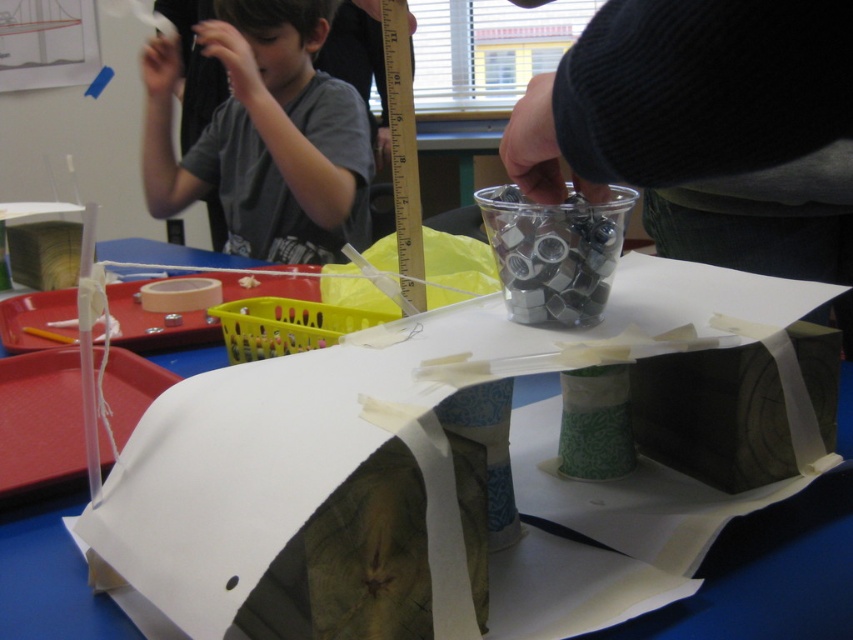
Is point (218, 112) more distant than point (529, 385)?

Yes, it is behind point (529, 385).

Consider the image. Between gray cotton shirt at upper left and blue paper at center, which one has less height?

blue paper at center

Does point (271, 131) come closer to viewer compared to point (177, 253)?

Yes, point (271, 131) is in front of point (177, 253).

I want to click on gray cotton shirt at upper left, so click(x=264, y=134).

Does blue paper at center have a smaller size compared to matte pink tape at left?

Actually, blue paper at center might be larger than matte pink tape at left.

Does point (532, 380) lie behind point (173, 282)?

No.

Between point (718, 557) and point (212, 304), which one is positioned behind?

The point (212, 304) is more distant.

Find the location of a particular element. blue paper at center is located at coordinates (769, 576).

Which is more to the left, gray cotton shirt at upper left or matte pink tape at left?

Positioned to the left is gray cotton shirt at upper left.

Who is lower down, gray cotton shirt at upper left or matte pink tape at left?

matte pink tape at left is lower down.

Describe the element at coordinates (264, 134) in the screenshot. I see `gray cotton shirt at upper left` at that location.

The height and width of the screenshot is (640, 853). Identify the location of gray cotton shirt at upper left. (264, 134).